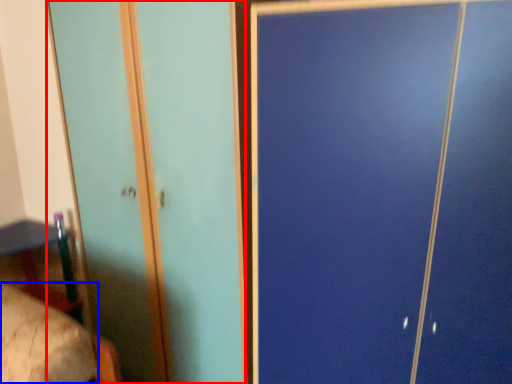
Question: Among these objects, which one is nearest to the camera, screen door (highlighted by a red box) or mattress (highlighted by a blue box)?

Choices:
 (A) screen door
 (B) mattress

Answer: (B)